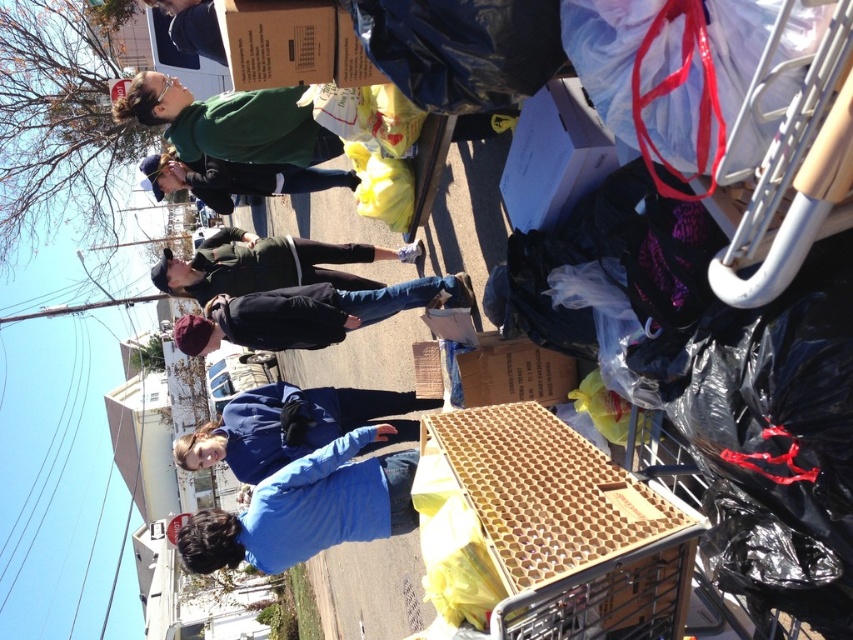
Question: Which of the following is the closest to the observer?

Choices:
 (A) (599, 547)
 (B) (254, 340)
 (C) (265, 540)

Answer: (A)

Question: From the image, what is the correct spatial relationship of green matte jacket at upper center in relation to cardboard box at upper center?

Choices:
 (A) right
 (B) left

Answer: (B)

Question: Can you confirm if green matte jacket at upper center is smaller than brown cardboard box at center?

Choices:
 (A) no
 (B) yes

Answer: (A)

Question: Which object is closer to the camera taking this photo?

Choices:
 (A) dark green jacket at center
 (B) cardboard box at upper center
 (C) green matte jacket at upper center
 (D) matte black jacket at upper center

Answer: (B)

Question: Observing the image, what is the correct spatial positioning of blue fabric jacket at lower center in reference to matte black jacket at upper center?

Choices:
 (A) above
 (B) below

Answer: (B)

Question: Which point is closer to the camera?

Choices:
 (A) green matte jacket at upper center
 (B) cardboard box at upper center
 (C) matte black jacket at upper center
 (D) black matte jacket at center

Answer: (B)